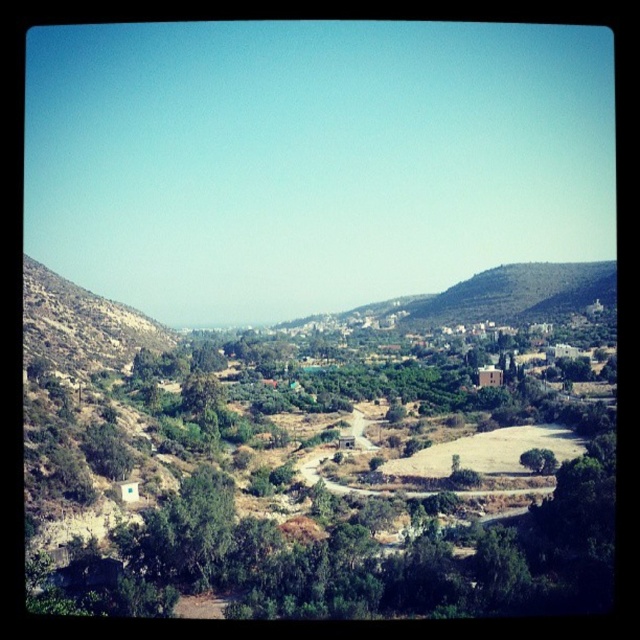
Is point (365, 365) positioned after point (528, 305)?

That is False.

Who is more forward, (x=394, y=524) or (x=493, y=268)?

Point (x=394, y=524) is in front.

Describe the element at coordinates (316, 497) in the screenshot. I see `green leafy tree at center` at that location.

Where is `green leafy tree at center`? The height and width of the screenshot is (640, 640). green leafy tree at center is located at coordinates (316, 497).

Is green shrubbery at left smaller than green grassy hillside at upper right?

No.

Which is below, green shrubbery at left or green grassy hillside at upper right?

green shrubbery at left

You are a GUI agent. You are given a task and a screenshot of the screen. Output one action in this format:
    pyautogui.click(x=<x>, y=<y>)
    Task: Click on the green shrubbery at left
    The height and width of the screenshot is (640, 640).
    Given the screenshot: What is the action you would take?
    pyautogui.click(x=81, y=324)

What do you see at coordinates (316, 497) in the screenshot? This screenshot has width=640, height=640. I see `green leafy tree at center` at bounding box center [316, 497].

Is point (531, 490) in front of point (122, 316)?

Yes, point (531, 490) is in front of point (122, 316).

Locate an element on the screen. Image resolution: width=640 pixels, height=640 pixels. green leafy tree at center is located at coordinates (316, 497).